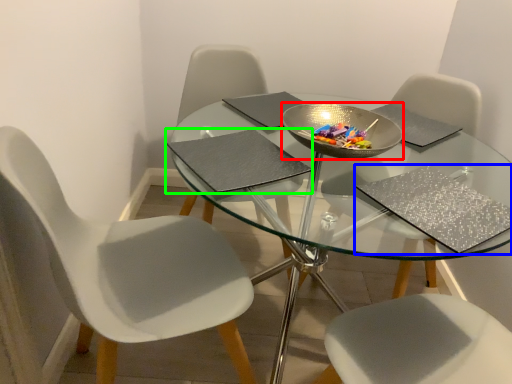
Question: Based on their relative distances, which object is nearer to bowl (highlighted by a red box)? Choose from place mat (highlighted by a blue box) and place mat (highlighted by a green box).

Choices:
 (A) place mat
 (B) place mat

Answer: (B)